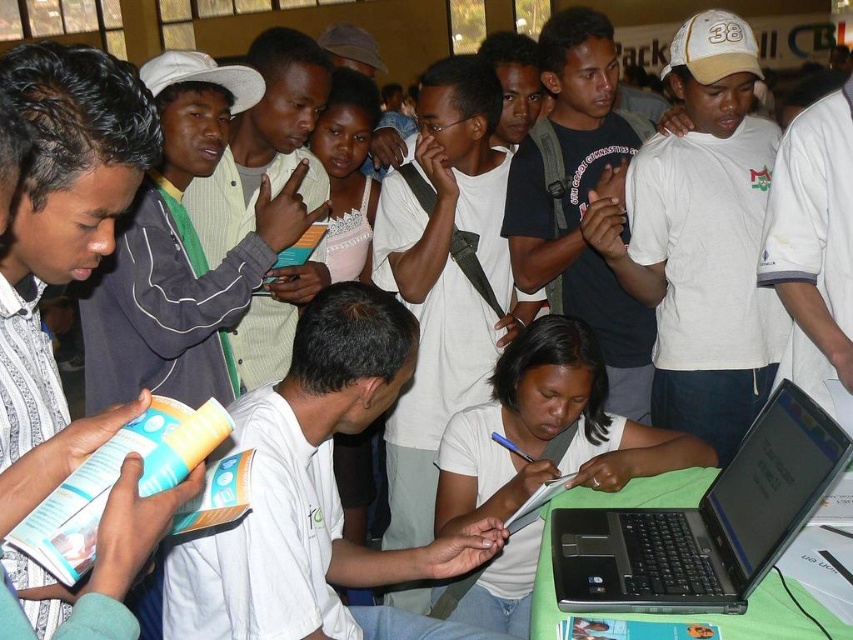
Is point (730, 476) less distant than point (520, 397)?

That is True.

What do you see at coordinates (704, 524) in the screenshot?
I see `black plastic laptop at lower right` at bounding box center [704, 524].

Locate an element on the screen. black plastic laptop at lower right is located at coordinates (704, 524).